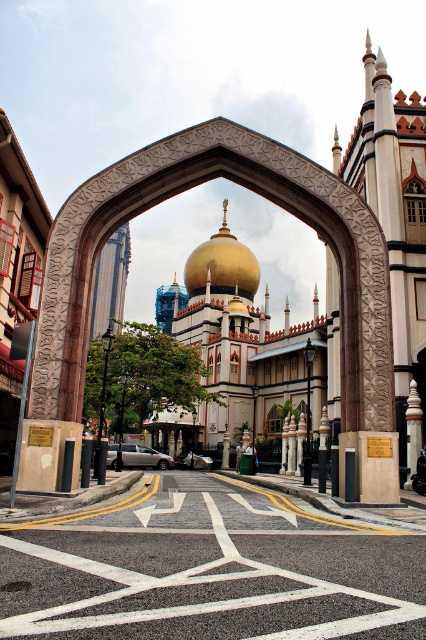
You are standing in front of the archway and want to take a photo of the gold polished dome at center and the green fabric person at center. Which object should you zoom in on to capture both in the frame without cropping?

You should zoom in on the green fabric person at center because the gold polished dome at center is wider than the green fabric person at center, so focusing on the smaller object allows both to fit in the frame.

You are standing in front of the archway and want to take a photo of the gold polished dome at center and the green fabric person at center. Which object should you zoom in on to ensure both are in focus without moving your camera?

You should zoom in on the gold polished dome at center because it is larger than the green fabric person at center, making it easier to capture both in focus without adjusting the camera position.

You are standing in front of the archway and want to take a photo of the gold polished dome at center and the green fabric person at center. Which one should you move your camera to the right to capture both in the frame?

You should move your camera to the right to include the gold polished dome at center because it is positioned on the left side of the green fabric person at center.